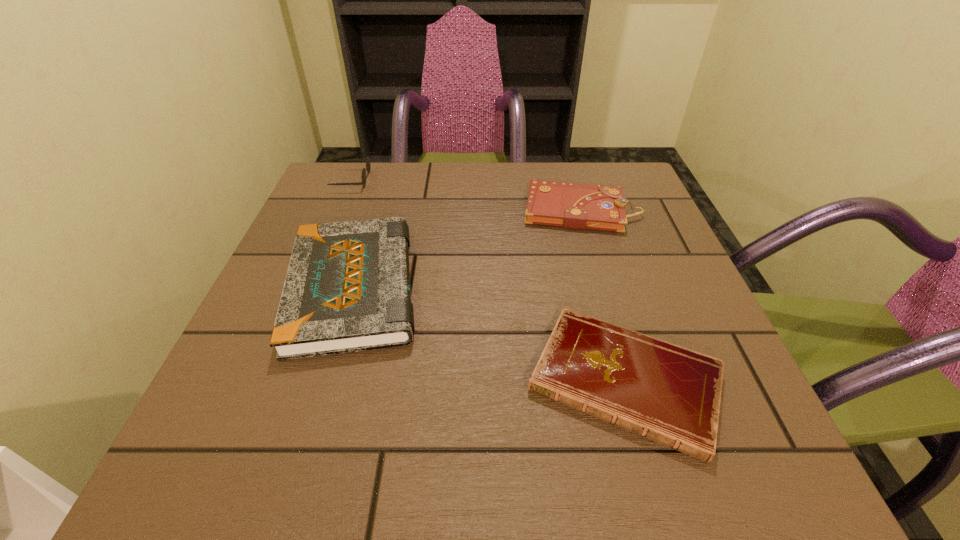
The width and height of the screenshot is (960, 540). Find the location of `vacant region that satisfies the following two spatial constraints: 1. on the front-facing side of the sunglasses; 2. on the back side of the shortest notebook`. vacant region that satisfies the following two spatial constraints: 1. on the front-facing side of the sunglasses; 2. on the back side of the shortest notebook is located at coordinates (269, 381).

Identify the location of vacant space that satisfies the following two spatial constraints: 1. on the front-facing side of the third tallest object; 2. on the left side of the sunglasses. This screenshot has height=540, width=960. (339, 210).

The height and width of the screenshot is (540, 960). I want to click on free region that satisfies the following two spatial constraints: 1. on the front side of the shortest object; 2. on the left side of the tallest notebook, so click(324, 381).

The image size is (960, 540). I want to click on vacant region that satisfies the following two spatial constraints: 1. on the front-facing side of the sunglasses; 2. on the left side of the tallest notebook, so click(307, 288).

The image size is (960, 540). What are the coordinates of `vacant region that satisfies the following two spatial constraints: 1. on the back side of the shortest notebook; 2. on the right side of the second shortest object` in the screenshot? It's located at (576, 210).

At what (x,y) coordinates should I click in order to perform the action: click on free location that satisfies the following two spatial constraints: 1. on the back side of the tallest notebook; 2. on the front-facing side of the sunglasses. Please return your answer as a coordinate pair (x, y). Looking at the image, I should click on (x=385, y=180).